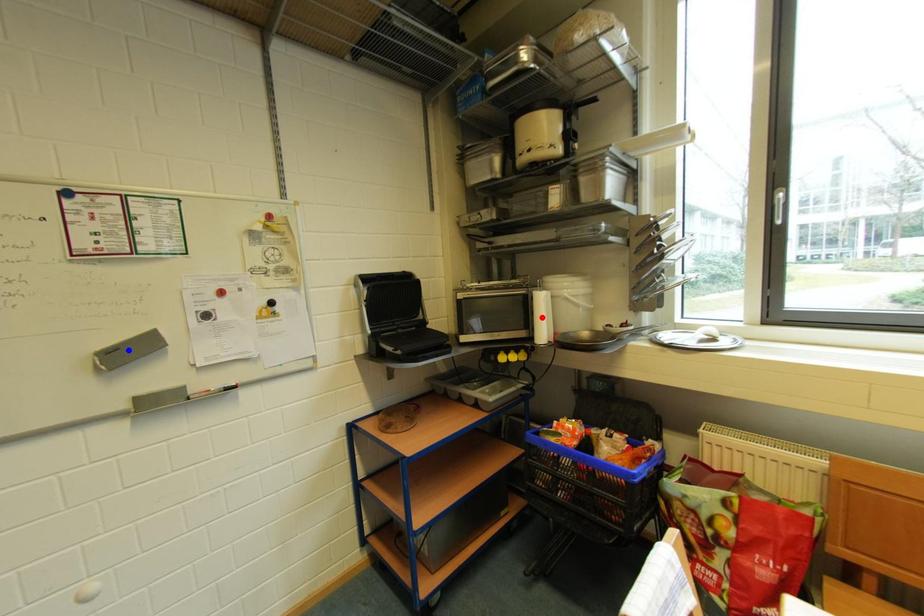
Question: In the image, two points are highlighted. Which point is nearer to the camera? Reply with the corresponding letter.

Choices:
 (A) blue point
 (B) red point

Answer: (A)